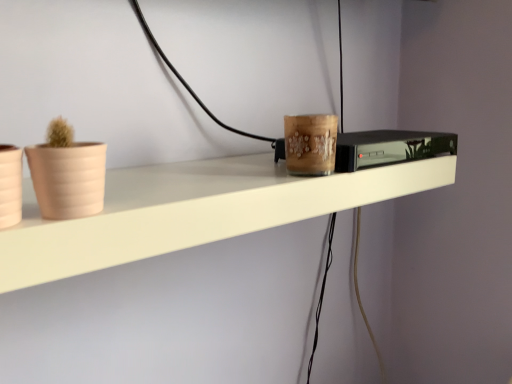
Describe the element at coordinates (10, 185) in the screenshot. The width and height of the screenshot is (512, 384). I see `matte beige flowerpot at left, positioned as the 1th flowerpot in left-to-right order` at that location.

Describe the element at coordinates (68, 179) in the screenshot. I see `beige matte flowerpot at left, the first flowerpot when ordered from right to left` at that location.

Identify the location of white matte shelf at center. This screenshot has width=512, height=384. (193, 211).

The image size is (512, 384). Find the location of `matte beige flowerpot at left, which is the 2th flowerpot in right-to-left order`. matte beige flowerpot at left, which is the 2th flowerpot in right-to-left order is located at coordinates (10, 185).

Image resolution: width=512 pixels, height=384 pixels. I want to click on appliance directly beneath the matte beige flowerpot at left, positioned as the 1th flowerpot in left-to-right order (from a real-world perspective), so click(390, 147).

Is point (3, 216) positioned before point (430, 150)?

Yes, point (3, 216) is closer to viewer.

Measure the distance between matte beige flowerpot at left, which is the 2th flowerpot in right-to-left order, and black glossy tv at center.

They are 47.52 centimeters apart.

Could you tell me if matte beige flowerpot at left, which is the 2th flowerpot in right-to-left order, is facing black glossy tv at center?

No.

Is black glossy tv at center positioned in front of matte beige flowerpot at left, positioned as the 1th flowerpot in left-to-right order?

No, the depth of black glossy tv at center is greater than that of matte beige flowerpot at left, positioned as the 1th flowerpot in left-to-right order.

Is matte beige flowerpot at left, which is the 2th flowerpot in right-to-left order, a part of black glossy tv at center?

That's incorrect, matte beige flowerpot at left, which is the 2th flowerpot in right-to-left order, is not inside black glossy tv at center.

At what (x,y) coordinates should I click in order to perform the action: click on the 2nd flowerpot counting from the left side of the black glossy tv at center. Please return your answer as a coordinate pair (x, y). The height and width of the screenshot is (384, 512). Looking at the image, I should click on (10, 185).

Between black glossy tv at center and matte beige flowerpot at left, which is the 2th flowerpot in right-to-left order, which one has larger size?

black glossy tv at center is bigger.

Is white matte shelf at center further to the viewer compared to matte beige flowerpot at left, which is the 2th flowerpot in right-to-left order?

Yes.

Would you say white matte shelf at center is outside matte beige flowerpot at left, which is the 2th flowerpot in right-to-left order?

Absolutely, white matte shelf at center is external to matte beige flowerpot at left, which is the 2th flowerpot in right-to-left order.

Can you confirm if white matte shelf at center is wider than matte beige flowerpot at left, which is the 2th flowerpot in right-to-left order?

Indeed, white matte shelf at center has a greater width compared to matte beige flowerpot at left, which is the 2th flowerpot in right-to-left order.

Based on the photo, from a real-world perspective, is white matte shelf at center located higher than matte beige flowerpot at left, positioned as the 1th flowerpot in left-to-right order?

No, from a real-world perspective, white matte shelf at center is not on top of matte beige flowerpot at left, positioned as the 1th flowerpot in left-to-right order.

Is white matte shelf at center positioned beyond the bounds of beige matte flowerpot at left, which ranks as the second flowerpot in left-to-right order?

Yes, white matte shelf at center is not within beige matte flowerpot at left, which ranks as the second flowerpot in left-to-right order.

Considering the relative sizes of white matte shelf at center and beige matte flowerpot at left, the first flowerpot when ordered from right to left, in the image provided, is white matte shelf at center taller than beige matte flowerpot at left, the first flowerpot when ordered from right to left,?

No, white matte shelf at center is not taller than beige matte flowerpot at left, the first flowerpot when ordered from right to left.

From the image's perspective, which one is positioned lower, white matte shelf at center or beige matte flowerpot at left, the first flowerpot when ordered from right to left?

white matte shelf at center appears lower in the image.

Does point (140, 172) come behind point (42, 156)?

Yes, it is.

Who is bigger, white matte shelf at center or black glossy tv at center?

white matte shelf at center.

From a real-world perspective, is white matte shelf at center under black glossy tv at center?

Yes, from a real-world perspective, white matte shelf at center is beneath black glossy tv at center.

Is white matte shelf at center next to black glossy tv at center and touching it?

No, white matte shelf at center is not next to black glossy tv at center.

Is white matte shelf at center turned away from black glossy tv at center?

→ No, white matte shelf at center is not facing the opposite direction of black glossy tv at center.

In terms of height, does beige matte flowerpot at left, the first flowerpot when ordered from right to left, look taller or shorter compared to black glossy tv at center?

In the image, beige matte flowerpot at left, the first flowerpot when ordered from right to left, appears to be taller than black glossy tv at center.

Is beige matte flowerpot at left, the first flowerpot when ordered from right to left, facing towards black glossy tv at center?

No, beige matte flowerpot at left, the first flowerpot when ordered from right to left, is not facing towards black glossy tv at center.

Does point (92, 212) come behind point (337, 156)?

No, (92, 212) is in front of (337, 156).

Would you say beige matte flowerpot at left, which ranks as the second flowerpot in left-to-right order, is outside black glossy tv at center?

Yes, beige matte flowerpot at left, which ranks as the second flowerpot in left-to-right order, is outside of black glossy tv at center.

Is black glossy tv at center facing towards white matte shelf at center?

No, black glossy tv at center does not turn towards white matte shelf at center.

Consider the image. Can you confirm if black glossy tv at center is bigger than white matte shelf at center?

Actually, black glossy tv at center might be smaller than white matte shelf at center.

Can you confirm if black glossy tv at center is positioned to the right of white matte shelf at center?

Yes.

From a real-world perspective, does black glossy tv at center sit lower than white matte shelf at center?

No, from a real-world perspective, black glossy tv at center is not beneath white matte shelf at center.

I want to click on appliance above the matte beige flowerpot at left, which is the 2th flowerpot in right-to-left order (from the image's perspective), so click(390, 147).

There is a black glossy tv at center. At what (x,y) coordinates should I click in order to perform the action: click on the 1st flowerpot above it (from a real-world perspective). Please return your answer as a coordinate pair (x, y). The height and width of the screenshot is (384, 512). Looking at the image, I should click on (10, 185).

Which object lies further to the anchor point black glossy tv at center, white matte shelf at center or beige matte flowerpot at left, which ranks as the second flowerpot in left-to-right order?

Among the two, beige matte flowerpot at left, which ranks as the second flowerpot in left-to-right order, is located further to black glossy tv at center.

Considering their positions, is white matte shelf at center positioned further to matte beige flowerpot at left, positioned as the 1th flowerpot in left-to-right order, than black glossy tv at center?

The object further to matte beige flowerpot at left, positioned as the 1th flowerpot in left-to-right order, is black glossy tv at center.

Estimate the real-world distances between objects in this image. Which object is closer to matte beige flowerpot at left, which is the 2th flowerpot in right-to-left order, beige matte flowerpot at left, the first flowerpot when ordered from right to left, or white matte shelf at center?

Among the two, beige matte flowerpot at left, the first flowerpot when ordered from right to left, is located nearer to matte beige flowerpot at left, which is the 2th flowerpot in right-to-left order.

Based on the photo, considering their positions, is black glossy tv at center positioned further to matte beige flowerpot at left, which is the 2th flowerpot in right-to-left order, than white matte shelf at center?

The object further to matte beige flowerpot at left, which is the 2th flowerpot in right-to-left order, is black glossy tv at center.

Estimate the real-world distances between objects in this image. Which object is further from beige matte flowerpot at left, which ranks as the second flowerpot in left-to-right order, matte beige flowerpot at left, which is the 2th flowerpot in right-to-left order, or black glossy tv at center?

black glossy tv at center.

Estimate the real-world distances between objects in this image. Which object is further from white matte shelf at center, matte beige flowerpot at left, which is the 2th flowerpot in right-to-left order, or black glossy tv at center?

matte beige flowerpot at left, which is the 2th flowerpot in right-to-left order.

Estimate the real-world distances between objects in this image. Which object is further from white matte shelf at center, black glossy tv at center or beige matte flowerpot at left, which ranks as the second flowerpot in left-to-right order?

The object further to white matte shelf at center is beige matte flowerpot at left, which ranks as the second flowerpot in left-to-right order.

Which object lies nearer to the anchor point beige matte flowerpot at left, the first flowerpot when ordered from right to left, matte beige flowerpot at left, which is the 2th flowerpot in right-to-left order, or white matte shelf at center?

matte beige flowerpot at left, which is the 2th flowerpot in right-to-left order, is closer to beige matte flowerpot at left, the first flowerpot when ordered from right to left.

Where is `flowerpot between matte beige flowerpot at left, positioned as the 1th flowerpot in left-to-right order, and black glossy tv at center, in the horizontal direction`? flowerpot between matte beige flowerpot at left, positioned as the 1th flowerpot in left-to-right order, and black glossy tv at center, in the horizontal direction is located at coordinates (68, 179).

The image size is (512, 384). What are the coordinates of `shelf between beige matte flowerpot at left, which ranks as the second flowerpot in left-to-right order, and black glossy tv at center` in the screenshot? It's located at tap(193, 211).

The image size is (512, 384). I want to click on shelf situated between matte beige flowerpot at left, positioned as the 1th flowerpot in left-to-right order, and black glossy tv at center from left to right, so click(x=193, y=211).

This screenshot has height=384, width=512. I want to click on flowerpot located between matte beige flowerpot at left, positioned as the 1th flowerpot in left-to-right order, and white matte shelf at center in the left-right direction, so click(x=68, y=179).